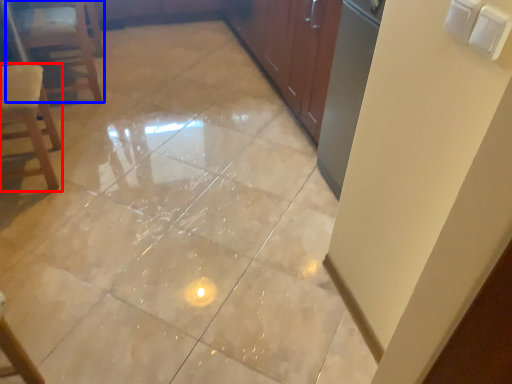
Question: Which of the following is the farthest to the observer, chair (highlighted by a red box) or furniture (highlighted by a blue box)?

Choices:
 (A) chair
 (B) furniture

Answer: (B)